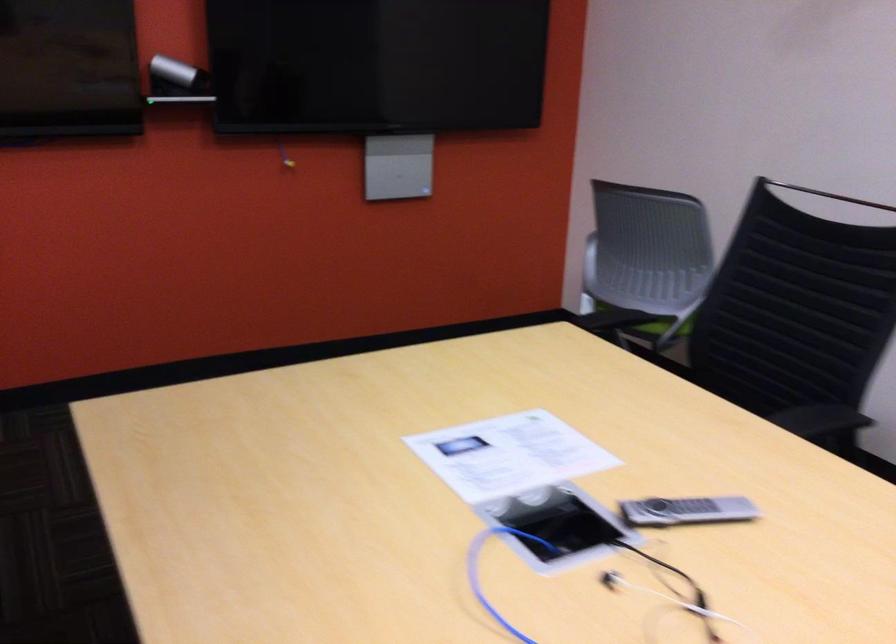
The width and height of the screenshot is (896, 644). What do you see at coordinates (653, 325) in the screenshot? I see `the chair sitting surface` at bounding box center [653, 325].